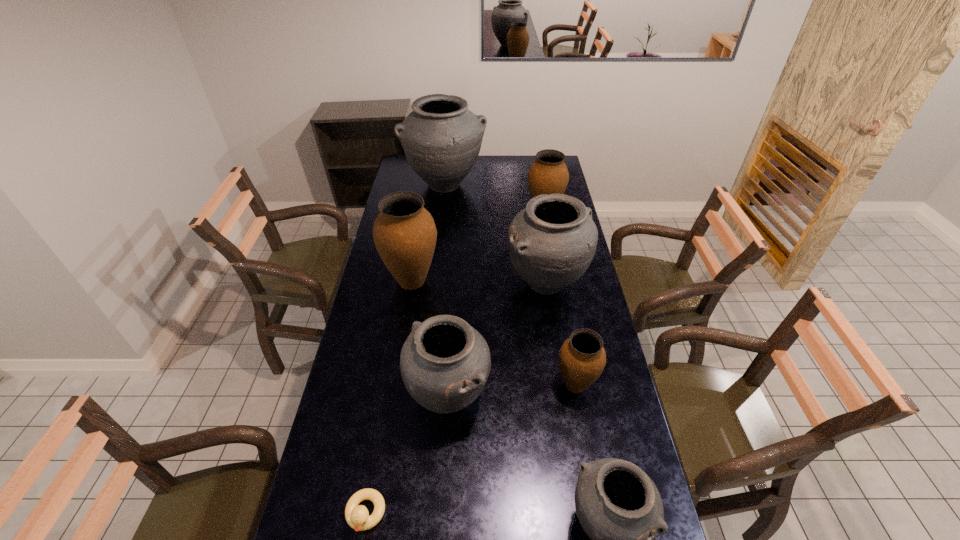
The image size is (960, 540). What are the coordinates of `free region that satisfies the following two spatial constraints: 1. on the back side of the biggest black urn; 2. on the left side of the leftmost brown urn` in the screenshot? It's located at (427, 185).